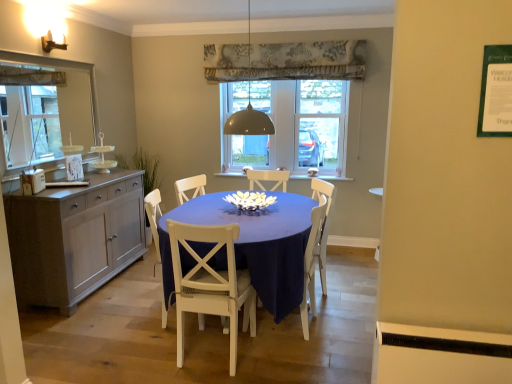
Question: From the image's perspective, is matte gray dome at center on white wood chair at center, arranged as the 2th chair when viewed from the right?

Choices:
 (A) no
 (B) yes

Answer: (B)

Question: Can you confirm if matte gray dome at center is smaller than white wood chair at center, arranged as the 2th chair when viewed from the right?

Choices:
 (A) no
 (B) yes

Answer: (B)

Question: Is matte gray dome at center behind white wood chair at center, arranged as the 2th chair when viewed from the right?

Choices:
 (A) yes
 (B) no

Answer: (A)

Question: From the image's perspective, is matte gray dome at center under white wood chair at center, arranged as the 2th chair when viewed from the right?

Choices:
 (A) no
 (B) yes

Answer: (A)

Question: Does matte gray dome at center turn towards white wood chair at center, the 2th chair in the left-to-right sequence?

Choices:
 (A) yes
 (B) no

Answer: (B)

Question: In terms of height, does clear glass door at center, which is the 2th glass door from right to left, look taller or shorter compared to transparent glass door at center, marked as the second glass door in a left-to-right arrangement?

Choices:
 (A) short
 (B) tall

Answer: (B)

Question: In the image, is clear glass door at center, which is the 2th glass door from right to left, positioned in front of or behind transparent glass door at center, marked as the second glass door in a left-to-right arrangement?

Choices:
 (A) front
 (B) behind

Answer: (B)

Question: Would you say clear glass door at center, which is the 2th glass door from right to left, is inside or outside transparent glass door at center, the 1th glass door viewed from the right?

Choices:
 (A) outside
 (B) inside

Answer: (A)

Question: Considering the positions of clear glass door at center, which appears as the first glass door when viewed from the left, and transparent glass door at center, marked as the second glass door in a left-to-right arrangement, in the image, is clear glass door at center, which appears as the first glass door when viewed from the left, wider or thinner than transparent glass door at center, marked as the second glass door in a left-to-right arrangement,?

Choices:
 (A) thin
 (B) wide

Answer: (A)

Question: Is wooden picture frame at left taller or shorter than matte glass mirror at left?

Choices:
 (A) short
 (B) tall

Answer: (A)

Question: Considering the positions of point (69, 173) and point (8, 107), is point (69, 173) closer or farther from the camera than point (8, 107)?

Choices:
 (A) closer
 (B) farther

Answer: (B)

Question: Is wooden picture frame at left inside the boundaries of matte glass mirror at left, or outside?

Choices:
 (A) inside
 (B) outside

Answer: (B)

Question: Would you say wooden picture frame at left is to the left or to the right of matte glass mirror at left in the picture?

Choices:
 (A) right
 (B) left

Answer: (A)

Question: Is transparent glass door at center, the 1th glass door viewed from the right, inside or outside of white wood chair at center, arranged as the 2th chair when viewed from the right?

Choices:
 (A) outside
 (B) inside

Answer: (A)

Question: Is transparent glass door at center, marked as the second glass door in a left-to-right arrangement, in front of or behind white wood chair at center, arranged as the 2th chair when viewed from the right, in the image?

Choices:
 (A) front
 (B) behind

Answer: (B)